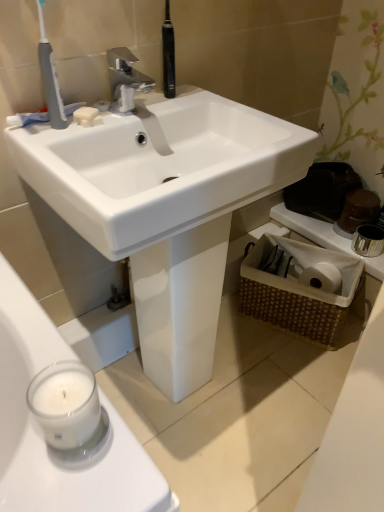
Question: Is white matte counter top at right thinner than gray plastic toothbrush at upper left?

Choices:
 (A) yes
 (B) no

Answer: (B)

Question: Are white matte counter top at right and gray plastic toothbrush at upper left located far from each other?

Choices:
 (A) no
 (B) yes

Answer: (A)

Question: From a real-world perspective, is white matte counter top at right on top of gray plastic toothbrush at upper left?

Choices:
 (A) no
 (B) yes

Answer: (A)

Question: From a real-world perspective, is white matte counter top at right beneath gray plastic toothbrush at upper left?

Choices:
 (A) no
 (B) yes

Answer: (B)

Question: Can you confirm if white matte counter top at right is smaller than gray plastic toothbrush at upper left?

Choices:
 (A) no
 (B) yes

Answer: (A)

Question: Does white matte counter top at right have a greater width compared to gray plastic toothbrush at upper left?

Choices:
 (A) yes
 (B) no

Answer: (A)

Question: Are white matte counter top at right and silver metallic faucet at upper center making contact?

Choices:
 (A) yes
 (B) no

Answer: (B)

Question: Can you confirm if white matte counter top at right is positioned to the right of silver metallic faucet at upper center?

Choices:
 (A) yes
 (B) no

Answer: (A)

Question: From a real-world perspective, is white matte counter top at right on silver metallic faucet at upper center?

Choices:
 (A) no
 (B) yes

Answer: (A)

Question: Is silver metallic faucet at upper center at the back of white matte counter top at right?

Choices:
 (A) yes
 (B) no

Answer: (B)

Question: Can you confirm if white matte counter top at right is bigger than silver metallic faucet at upper center?

Choices:
 (A) no
 (B) yes

Answer: (B)

Question: Would you say white matte counter top at right is a long distance from silver metallic faucet at upper center?

Choices:
 (A) yes
 (B) no

Answer: (B)

Question: Is white glossy sink at center aimed at silver metallic faucet at upper center?

Choices:
 (A) yes
 (B) no

Answer: (B)